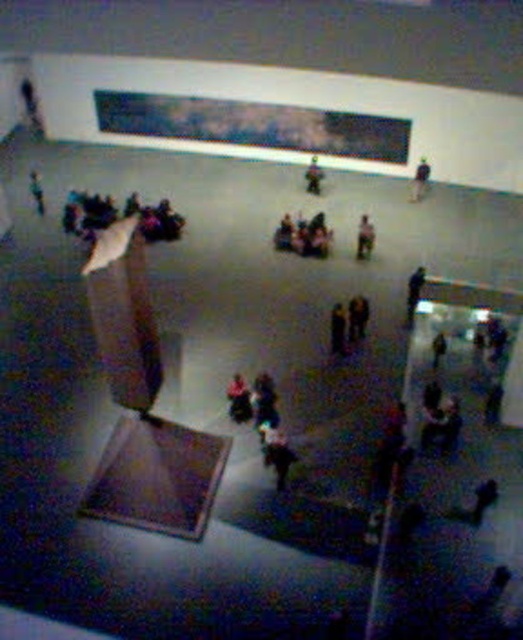
Question: Which of these objects is positioned farthest from the smooth brown coat at center?

Choices:
 (A) wooden statue at center
 (B) dark blue jeans at center
 (C) dark blue fabric at lower right

Answer: (A)

Question: Based on their relative distances, which object is farther from the dark blue jeans at center?

Choices:
 (A) wooden statue at center
 (B) dark gray fabric jacket at upper right

Answer: (B)

Question: Which is nearer to the wooden statue at center?

Choices:
 (A) matte black statue at upper left
 (B) dark blue fabric at lower right
 (C) dark gray fabric jacket at center
 (D) dark brown leather jacket at center

Answer: (B)

Question: Does dark brown leather jacket at center lie behind matte black statue at upper left?

Choices:
 (A) yes
 (B) no

Answer: (B)

Question: Is dark brown leather jacket at center positioned at the back of smooth brown coat at center?

Choices:
 (A) yes
 (B) no

Answer: (A)

Question: Can you confirm if dark blue jeans at center is bigger than dark gray fabric jacket at upper right?

Choices:
 (A) yes
 (B) no

Answer: (B)